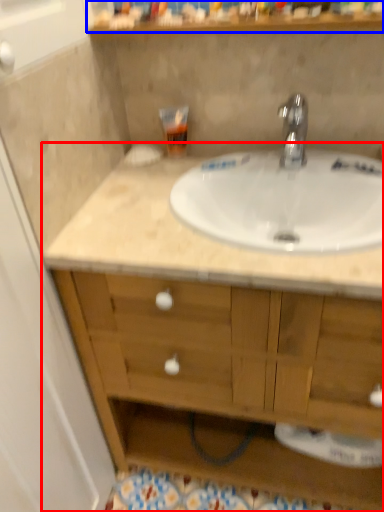
Question: Which point is further to the camera, bathroom cabinet (highlighted by a red box) or shelf (highlighted by a blue box)?

Choices:
 (A) bathroom cabinet
 (B) shelf

Answer: (B)